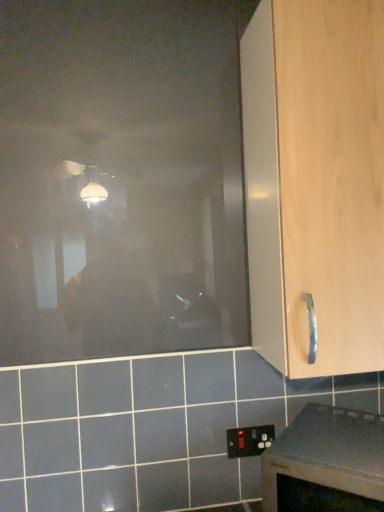
What do you see at coordinates (249, 440) in the screenshot?
I see `black plastic electric outlet at lower center` at bounding box center [249, 440].

At what (x,y) coordinates should I click in order to perform the action: click on light wood cabinet handle at right. Please return your answer as a coordinate pair (x, y). Looking at the image, I should click on (315, 182).

Find the location of a particular element. This screenshot has height=512, width=384. transparent matte glass door at upper left is located at coordinates (121, 178).

Who is shorter, smooth gray countertop at lower right or black plastic electric outlet at lower center?

black plastic electric outlet at lower center.

Is smooth gray countertop at lower right next to black plastic electric outlet at lower center and touching it?

smooth gray countertop at lower right and black plastic electric outlet at lower center are clearly separated.

Which object is closer to the camera taking this photo, smooth gray countertop at lower right or black plastic electric outlet at lower center?

smooth gray countertop at lower right is closer to the camera.

Consider the image. Considering the positions of objects smooth gray countertop at lower right and black plastic electric outlet at lower center in the image provided, who is more to the left, smooth gray countertop at lower right or black plastic electric outlet at lower center?

black plastic electric outlet at lower center.

Is transparent matte glass door at upper left oriented towards black plastic electric outlet at lower center?

No, transparent matte glass door at upper left is not oriented towards black plastic electric outlet at lower center.

Is transparent matte glass door at upper left located outside black plastic electric outlet at lower center?

Yes, transparent matte glass door at upper left is located beyond the bounds of black plastic electric outlet at lower center.

Is transparent matte glass door at upper left wider than black plastic electric outlet at lower center?

Correct, the width of transparent matte glass door at upper left exceeds that of black plastic electric outlet at lower center.

From the image's perspective, is transparent matte glass door at upper left located above black plastic electric outlet at lower center?

Correct, transparent matte glass door at upper left appears higher than black plastic electric outlet at lower center in the image.

Considering the sizes of transparent matte glass door at upper left and light wood cabinet handle at right in the image, is transparent matte glass door at upper left taller or shorter than light wood cabinet handle at right?

In the image, transparent matte glass door at upper left appears to be taller than light wood cabinet handle at right.

Can you confirm if transparent matte glass door at upper left is thinner than light wood cabinet handle at right?

Yes, transparent matte glass door at upper left is thinner than light wood cabinet handle at right.

How distant is transparent matte glass door at upper left from light wood cabinet handle at right?

15.23 inches.

Is transparent matte glass door at upper left oriented away from light wood cabinet handle at right?

No, transparent matte glass door at upper left's orientation is not away from light wood cabinet handle at right.

Who is shorter, transparent matte glass door at upper left or smooth gray countertop at lower right?

Standing shorter between the two is smooth gray countertop at lower right.

Is transparent matte glass door at upper left to the left of smooth gray countertop at lower right from the viewer's perspective?

Indeed, transparent matte glass door at upper left is positioned on the left side of smooth gray countertop at lower right.

This screenshot has width=384, height=512. Find the location of `countertop that appears on the right of transparent matte glass door at upper left`. countertop that appears on the right of transparent matte glass door at upper left is located at coordinates (326, 462).

In terms of size, does transparent matte glass door at upper left appear bigger or smaller than smooth gray countertop at lower right?

Clearly, transparent matte glass door at upper left is smaller in size than smooth gray countertop at lower right.

Which point is more forward, (322,510) or (326,16)?

The point (322,510) is closer to the camera.

From the image's perspective, is smooth gray countertop at lower right located above light wood cabinet handle at right?

Actually, smooth gray countertop at lower right appears below light wood cabinet handle at right in the image.

Which object is wider, smooth gray countertop at lower right or light wood cabinet handle at right?

Wider between the two is smooth gray countertop at lower right.

From a real-world perspective, is smooth gray countertop at lower right physically located above or below light wood cabinet handle at right?

From a real-world perspective, smooth gray countertop at lower right is physically below light wood cabinet handle at right.

From the image's perspective, is light wood cabinet handle at right below black plastic electric outlet at lower center?

No, from the image's perspective, light wood cabinet handle at right is not below black plastic electric outlet at lower center.

Is point (264, 164) more distant than point (261, 444)?

No, (264, 164) is closer to viewer.

Considering the sizes of objects light wood cabinet handle at right and black plastic electric outlet at lower center in the image provided, who is shorter, light wood cabinet handle at right or black plastic electric outlet at lower center?

With less height is black plastic electric outlet at lower center.

Is smooth gray countertop at lower right in front of transparent matte glass door at upper left?

Yes, smooth gray countertop at lower right is closer to the viewer.

Is smooth gray countertop at lower right touching transparent matte glass door at upper left?

They are not placed beside each other.

Based on the photo, is transparent matte glass door at upper left a part of smooth gray countertop at lower right?

No, transparent matte glass door at upper left is not a part of smooth gray countertop at lower right.

Is smooth gray countertop at lower right oriented away from transparent matte glass door at upper left?

No, smooth gray countertop at lower right is not facing the opposite direction of transparent matte glass door at upper left.

You are a GUI agent. You are given a task and a screenshot of the screen. Output one action in this format:
    pyautogui.click(x=<x>, y=<y>)
    Task: Click on the countertop below the black plastic electric outlet at lower center (from the image's perspective)
    The width and height of the screenshot is (384, 512).
    Given the screenshot: What is the action you would take?
    tap(326, 462)

Where is `glass door on the left side of black plastic electric outlet at lower center`? glass door on the left side of black plastic electric outlet at lower center is located at coordinates (121, 178).

Which object lies further to the anchor point black plastic electric outlet at lower center, smooth gray countertop at lower right or light wood cabinet handle at right?

light wood cabinet handle at right.

From the picture: When comparing their distances from black plastic electric outlet at lower center, does transparent matte glass door at upper left or light wood cabinet handle at right seem further?

transparent matte glass door at upper left is positioned further to the anchor black plastic electric outlet at lower center.

Considering their positions, is black plastic electric outlet at lower center positioned closer to transparent matte glass door at upper left than smooth gray countertop at lower right?

smooth gray countertop at lower right is closer to transparent matte glass door at upper left.

Estimate the real-world distances between objects in this image. Which object is closer to smooth gray countertop at lower right, black plastic electric outlet at lower center or light wood cabinet handle at right?

Among the two, black plastic electric outlet at lower center is located nearer to smooth gray countertop at lower right.

Estimate the real-world distances between objects in this image. Which object is further from smooth gray countertop at lower right, black plastic electric outlet at lower center or transparent matte glass door at upper left?

transparent matte glass door at upper left is further to smooth gray countertop at lower right.

Estimate the real-world distances between objects in this image. Which object is further from transparent matte glass door at upper left, black plastic electric outlet at lower center or light wood cabinet handle at right?

black plastic electric outlet at lower center.

When comparing their distances from transparent matte glass door at upper left, does smooth gray countertop at lower right or light wood cabinet handle at right seem closer?

light wood cabinet handle at right is closer to transparent matte glass door at upper left.

From the image, which object appears to be nearer to light wood cabinet handle at right, smooth gray countertop at lower right or black plastic electric outlet at lower center?

Among the two, smooth gray countertop at lower right is located nearer to light wood cabinet handle at right.

Where is `electric outlet between transparent matte glass door at upper left and smooth gray countertop at lower right from top to bottom`? The width and height of the screenshot is (384, 512). electric outlet between transparent matte glass door at upper left and smooth gray countertop at lower right from top to bottom is located at coordinates (249, 440).

The image size is (384, 512). Find the location of `cabinetry between transparent matte glass door at upper left and black plastic electric outlet at lower center in the up-down direction`. cabinetry between transparent matte glass door at upper left and black plastic electric outlet at lower center in the up-down direction is located at coordinates (315, 182).

This screenshot has height=512, width=384. I want to click on cabinetry that lies between transparent matte glass door at upper left and smooth gray countertop at lower right from top to bottom, so click(315, 182).

Locate an element on the screen. The width and height of the screenshot is (384, 512). electric outlet between light wood cabinet handle at right and smooth gray countertop at lower right in the up-down direction is located at coordinates (249, 440).